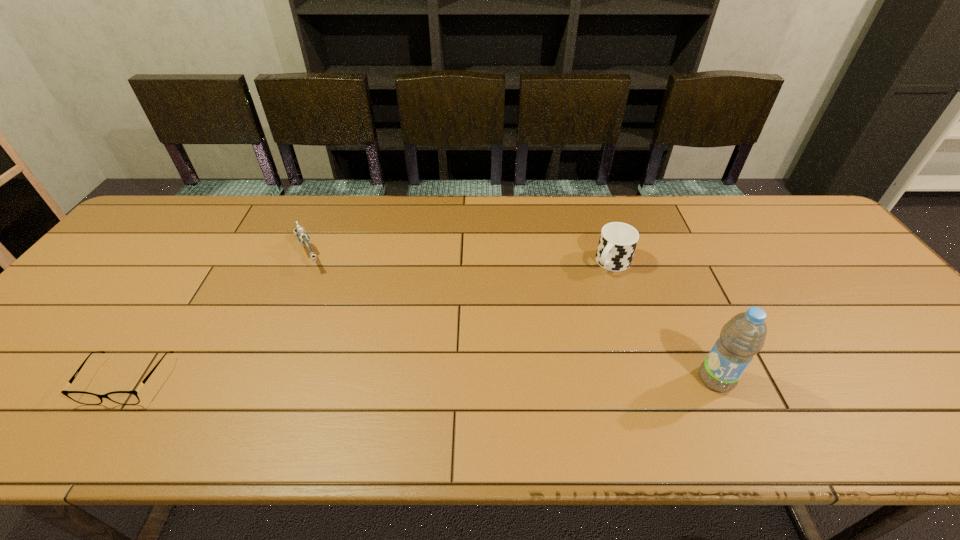
The height and width of the screenshot is (540, 960). I want to click on vacant space on the desktop that is between the leftmost object and the rightmost object and is positioned aimed along the barrel of the second shortest object, so click(x=372, y=380).

In order to click on free space on the desktop that is between the shortest object and the tallest object and is positioned on the side of the cup with the handle in this screenshot , I will do `click(504, 380)`.